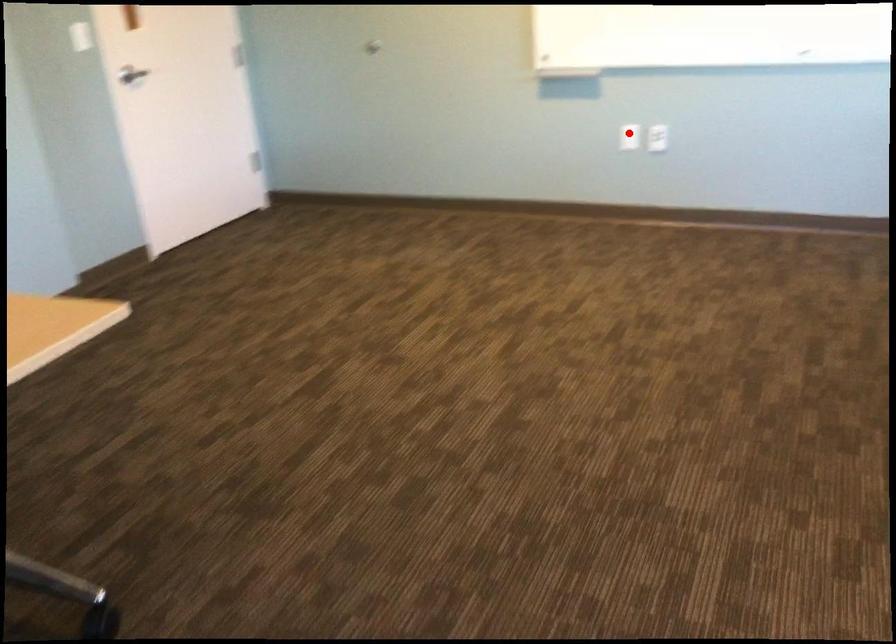
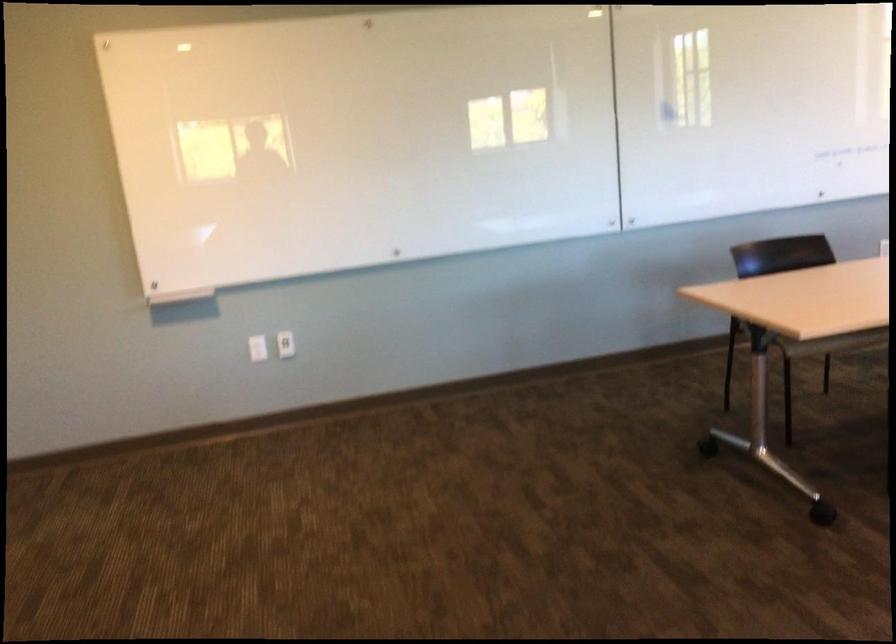
Locate, in the second image, the point that corresponds to the highlighted location in the first image.

(256, 348)